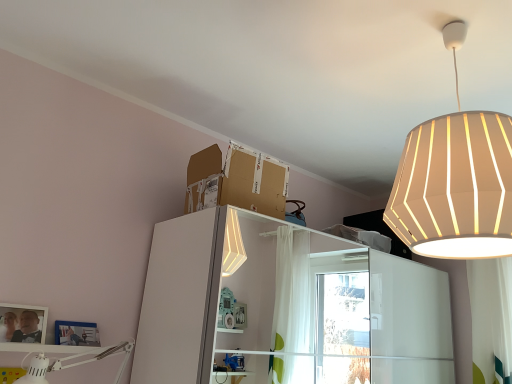
Identify the location of matte silver picture frame at lower left. (22, 323).

The image size is (512, 384). What do you see at coordinates (490, 319) in the screenshot?
I see `white fabric curtain at right` at bounding box center [490, 319].

Describe the element at coordinates (236, 181) in the screenshot. The width and height of the screenshot is (512, 384). I see `brown cardboard box at upper center` at that location.

Locate an element on the screen. white glossy bookshelf at upper center is located at coordinates (285, 307).

Measure the distance between white matte desk lamp at lower left, arranged as the 1th lamp when viewed from the left, and camera.

The depth of white matte desk lamp at lower left, arranged as the 1th lamp when viewed from the left, is 4.94 feet.

What do you see at coordinates (73, 363) in the screenshot?
I see `white matte desk lamp at lower left, which is counted as the second lamp, starting from the right` at bounding box center [73, 363].

Find the location of a particular element. Image resolution: width=512 pixels, height=384 pixels. white fabric lampshade at upper right, positioned as the first lamp in top-to-bottom order is located at coordinates (455, 181).

Which object is positioned more to the right, matte silver picture frame at lower left or white fabric lampshade at upper right, placed as the second lamp when sorted from bottom to top?

From the viewer's perspective, white fabric lampshade at upper right, placed as the second lamp when sorted from bottom to top, appears more on the right side.

Would you say matte silver picture frame at lower left is a long distance from white fabric lampshade at upper right, placed as the second lamp when sorted from bottom to top?

matte silver picture frame at lower left is positioned a significant distance from white fabric lampshade at upper right, placed as the second lamp when sorted from bottom to top.

Is matte silver picture frame at lower left positioned with its back to white fabric lampshade at upper right, placed as the second lamp when sorted from bottom to top?

No, matte silver picture frame at lower left's orientation is not away from white fabric lampshade at upper right, placed as the second lamp when sorted from bottom to top.

Is point (121, 342) more distant than point (473, 351)?

No.

In the scene shown: Can you confirm if white matte desk lamp at lower left, which is counted as the second lamp, starting from the right, is wider than white fabric curtain at right?

Yes.

Considering the sizes of objects white matte desk lamp at lower left, which is counted as the second lamp, starting from the right, and white fabric curtain at right in the image provided, who is bigger, white matte desk lamp at lower left, which is counted as the second lamp, starting from the right, or white fabric curtain at right?

white fabric curtain at right is bigger.

Measure the distance from brown cardboard box at upper center to white matte desk lamp at lower left, which is counted as the second lamp, starting from the right.

brown cardboard box at upper center is 36.39 inches away from white matte desk lamp at lower left, which is counted as the second lamp, starting from the right.

Locate an element on the screen. The height and width of the screenshot is (384, 512). lamp that is the 1st object located in front of the brown cardboard box at upper center is located at coordinates (x=73, y=363).

Can you confirm if brown cardboard box at upper center is smaller than white matte desk lamp at lower left, which is counted as the second lamp, starting from the right?

Actually, brown cardboard box at upper center might be larger than white matte desk lamp at lower left, which is counted as the second lamp, starting from the right.

Does point (285, 182) appear closer or farther from the camera than point (34, 351)?

Point (285, 182).

Based on the photo, how many degrees apart are the facing directions of matte silver picture frame at lower left and white glossy bookshelf at upper center?

There is a 0.909-degree angle between the facing directions of matte silver picture frame at lower left and white glossy bookshelf at upper center.

Is point (34, 325) positioned after point (292, 271)?

No, (34, 325) is in front of (292, 271).

Does matte silver picture frame at lower left turn towards white glossy bookshelf at upper center?

No, matte silver picture frame at lower left is not turned towards white glossy bookshelf at upper center.

From the image's perspective, is matte silver picture frame at lower left over white glossy bookshelf at upper center?

Yes, from the image's perspective, matte silver picture frame at lower left is over white glossy bookshelf at upper center.

Is white glossy bookshelf at upper center touching white matte desk lamp at lower left, positioned as the second lamp in top-to-bottom order?

white glossy bookshelf at upper center and white matte desk lamp at lower left, positioned as the second lamp in top-to-bottom order, are clearly separated.

Which is correct: white glossy bookshelf at upper center is inside white matte desk lamp at lower left, arranged as the 1th lamp when viewed from the left, or outside of it?

white glossy bookshelf at upper center is spatially situated outside white matte desk lamp at lower left, arranged as the 1th lamp when viewed from the left.

Does white glossy bookshelf at upper center have a larger size compared to white matte desk lamp at lower left, arranged as the 1th lamp when viewed from the left?

Indeed, white glossy bookshelf at upper center has a larger size compared to white matte desk lamp at lower left, arranged as the 1th lamp when viewed from the left.

From the image's perspective, is white fabric lampshade at upper right, placed as the 1th lamp when sorted from right to left, under white glossy bookshelf at upper center?

No, from the image's perspective, white fabric lampshade at upper right, placed as the 1th lamp when sorted from right to left, is not below white glossy bookshelf at upper center.

Which is more to the right, white fabric lampshade at upper right, placed as the second lamp when sorted from bottom to top, or white glossy bookshelf at upper center?

white fabric lampshade at upper right, placed as the second lamp when sorted from bottom to top.

Which object is more forward, white fabric lampshade at upper right, positioned as the first lamp in top-to-bottom order, or white glossy bookshelf at upper center?

white fabric lampshade at upper right, positioned as the first lamp in top-to-bottom order.

Considering the relative sizes of white fabric lampshade at upper right, positioned as the first lamp in top-to-bottom order, and white glossy bookshelf at upper center in the image provided, is white fabric lampshade at upper right, positioned as the first lamp in top-to-bottom order, smaller than white glossy bookshelf at upper center?

Indeed, white fabric lampshade at upper right, positioned as the first lamp in top-to-bottom order, has a smaller size compared to white glossy bookshelf at upper center.

Consider the image. Between white matte desk lamp at lower left, positioned as the second lamp in top-to-bottom order, and matte silver picture frame at lower left, which one appears on the right side from the viewer's perspective?

white matte desk lamp at lower left, positioned as the second lamp in top-to-bottom order, is more to the right.

From the image's perspective, is white matte desk lamp at lower left, arranged as the 1th lamp when viewed from the left, located above or below matte silver picture frame at lower left?

From the image's perspective, white matte desk lamp at lower left, arranged as the 1th lamp when viewed from the left, appears below matte silver picture frame at lower left.

Who is smaller, white matte desk lamp at lower left, which is counted as the second lamp, starting from the right, or matte silver picture frame at lower left?

With smaller size is matte silver picture frame at lower left.

In order to click on the 2nd lamp counting from the right of the matte silver picture frame at lower left in this screenshot , I will do `click(455, 181)`.

This screenshot has height=384, width=512. Identify the location of the 1st lamp above when counting from the white fabric curtain at right (from the image's perspective). (73, 363).

Estimate the real-world distances between objects in this image. Which object is further from white glossy bookshelf at upper center, white fabric lampshade at upper right, placed as the 1th lamp when sorted from right to left, or matte silver picture frame at lower left?

matte silver picture frame at lower left is positioned further to the anchor white glossy bookshelf at upper center.

From the image, which object appears to be farther from white glossy bookshelf at upper center, white fabric curtain at right or white matte desk lamp at lower left, which is counted as the second lamp, starting from the right?

white matte desk lamp at lower left, which is counted as the second lamp, starting from the right, lies further to white glossy bookshelf at upper center than the other object.

Based on their spatial positions, is white glossy bookshelf at upper center or white matte desk lamp at lower left, arranged as the 1th lamp when viewed from the left, further from white fabric lampshade at upper right, positioned as the first lamp in top-to-bottom order?

white glossy bookshelf at upper center lies further to white fabric lampshade at upper right, positioned as the first lamp in top-to-bottom order, than the other object.

Based on their spatial positions, is brown cardboard box at upper center or white matte desk lamp at lower left, positioned as the second lamp in top-to-bottom order, closer to white fabric curtain at right?

Based on the image, brown cardboard box at upper center appears to be nearer to white fabric curtain at right.

Which object lies nearer to the anchor point matte silver picture frame at lower left, white fabric curtain at right or white fabric lampshade at upper right, placed as the 1th lamp when sorted from right to left?

The object closer to matte silver picture frame at lower left is white fabric lampshade at upper right, placed as the 1th lamp when sorted from right to left.

From the picture: When comparing their distances from brown cardboard box at upper center, does white fabric curtain at right or white glossy bookshelf at upper center seem closer?

white fabric curtain at right is closer to brown cardboard box at upper center.

When comparing their distances from brown cardboard box at upper center, does white fabric lampshade at upper right, placed as the 1th lamp when sorted from right to left, or white matte desk lamp at lower left, arranged as the 1th lamp when viewed from the left, seem further?

white matte desk lamp at lower left, arranged as the 1th lamp when viewed from the left, lies further to brown cardboard box at upper center than the other object.

From the image, which object appears to be farther from white fabric lampshade at upper right, positioned as the first lamp in top-to-bottom order, white matte desk lamp at lower left, positioned as the second lamp in top-to-bottom order, or matte silver picture frame at lower left?

matte silver picture frame at lower left lies further to white fabric lampshade at upper right, positioned as the first lamp in top-to-bottom order, than the other object.

You are a GUI agent. You are given a task and a screenshot of the screen. Output one action in this format:
    pyautogui.click(x=<x>, y=<y>)
    Task: Click on the bookshelf situated between brown cardboard box at upper center and white fabric curtain at right from left to right
    
    Given the screenshot: What is the action you would take?
    pyautogui.click(x=285, y=307)

Identify the location of cardboard box between white matte desk lamp at lower left, positioned as the second lamp in top-to-bottom order, and white glossy bookshelf at upper center from left to right. (236, 181).

I want to click on cardboard box between white fabric lampshade at upper right, placed as the 1th lamp when sorted from right to left, and white glossy bookshelf at upper center vertically, so click(236, 181).

Locate an element on the screen. This screenshot has height=384, width=512. cardboard box situated between matte silver picture frame at lower left and white glossy bookshelf at upper center from left to right is located at coordinates (236, 181).